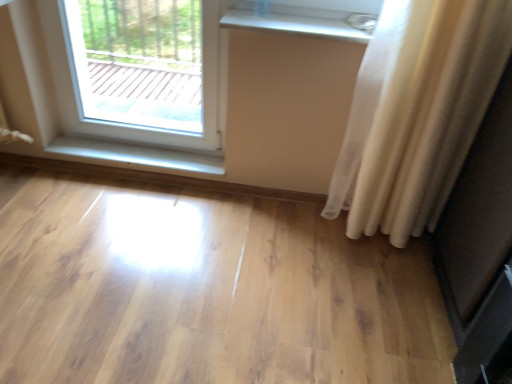
Question: Is white sheer curtain at right next to matte black screen door at right?

Choices:
 (A) yes
 (B) no

Answer: (B)

Question: Is white sheer curtain at right bigger than matte black screen door at right?

Choices:
 (A) no
 (B) yes

Answer: (A)

Question: Considering the relative sizes of white sheer curtain at right and matte black screen door at right in the image provided, is white sheer curtain at right wider than matte black screen door at right?

Choices:
 (A) no
 (B) yes

Answer: (A)

Question: Does white sheer curtain at right appear on the right side of matte black screen door at right?

Choices:
 (A) no
 (B) yes

Answer: (A)

Question: Are white sheer curtain at right and matte black screen door at right far apart?

Choices:
 (A) no
 (B) yes

Answer: (A)

Question: Is white sheer curtain at right shorter than matte black screen door at right?

Choices:
 (A) yes
 (B) no

Answer: (B)

Question: Are light wood floor at center and white glossy wood at lower left, the first window sill ordered from the bottom, located far from each other?

Choices:
 (A) no
 (B) yes

Answer: (A)

Question: From a real-world perspective, is light wood floor at center located beneath white glossy wood at lower left, which is counted as the 1th window sill, starting from the left?

Choices:
 (A) yes
 (B) no

Answer: (A)

Question: Is light wood floor at center to the right of white glossy wood at lower left, acting as the 2th window sill starting from the right, from the viewer's perspective?

Choices:
 (A) no
 (B) yes

Answer: (B)

Question: Does light wood floor at center turn towards white glossy wood at lower left, which is the second window sill in front-to-back order?

Choices:
 (A) no
 (B) yes

Answer: (A)

Question: Is light wood floor at center further to the viewer compared to white glossy wood at lower left, which appears as the 1th window sill when viewed from the back?

Choices:
 (A) yes
 (B) no

Answer: (B)

Question: Considering the relative sizes of light wood floor at center and white glossy wood at lower left, which appears as the 1th window sill when viewed from the back, in the image provided, is light wood floor at center shorter than white glossy wood at lower left, which appears as the 1th window sill when viewed from the back,?

Choices:
 (A) yes
 (B) no

Answer: (B)

Question: Does matte black screen door at right turn towards white glossy radiator at upper center, positioned as the second window sill in back-to-front order?

Choices:
 (A) no
 (B) yes

Answer: (A)